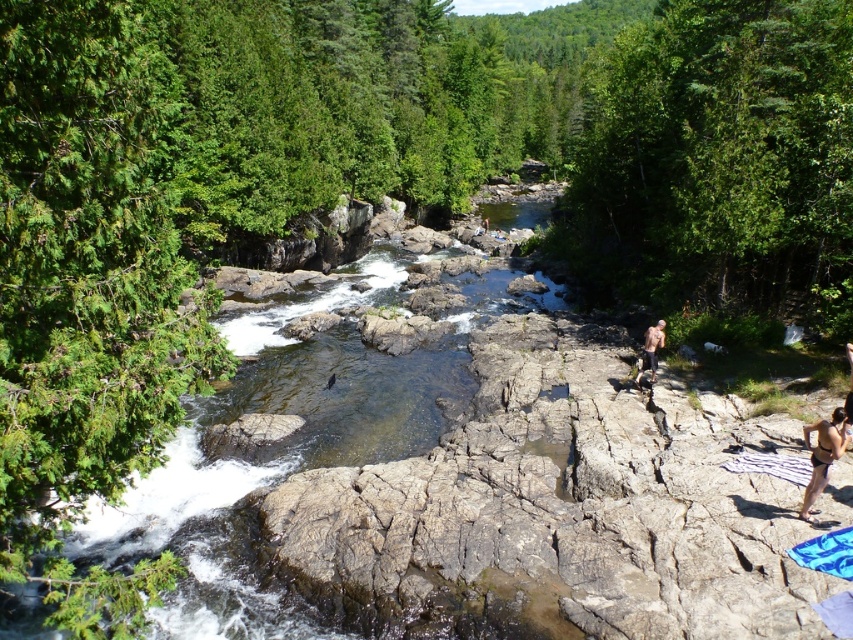
Question: Is white striped beach towel at lower right behind skinny man at center?

Choices:
 (A) yes
 (B) no

Answer: (B)

Question: Which point is closer to the camera?

Choices:
 (A) white striped beach towel at lower right
 (B) brown skin at lower right
 (C) clear water at center
 (D) skinny man at center

Answer: (C)

Question: Which of the following is the farthest from the observer?

Choices:
 (A) clear water at center
 (B) brown skin at lower right
 (C) white striped beach towel at lower right
 (D) skinny man at center

Answer: (D)

Question: Observing the image, what is the correct spatial positioning of brown skin at lower right in reference to white striped beach towel at lower right?

Choices:
 (A) left
 (B) right

Answer: (B)

Question: Can you confirm if white striped beach towel at lower right is smaller than skinny man at center?

Choices:
 (A) yes
 (B) no

Answer: (B)

Question: Based on their relative distances, which object is nearer to the white striped beach towel at lower right?

Choices:
 (A) clear water at center
 (B) brown skin at lower right

Answer: (B)